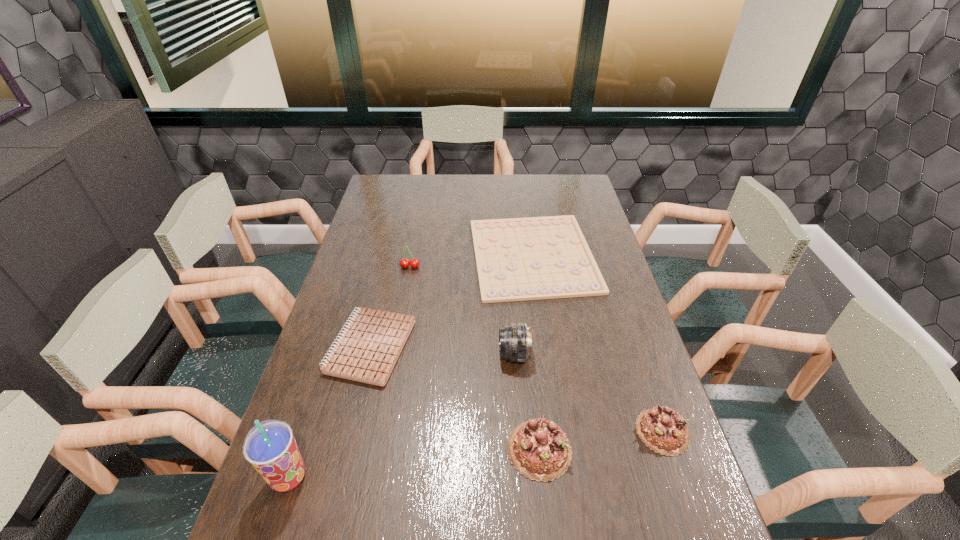
Where is `the fourth shortest object`? the fourth shortest object is located at coordinates (538, 449).

I want to click on the taller chocolate cake, so click(538, 449).

At what (x,y) coordinates should I click in order to perform the action: click on the right chocolate cake. Please return your answer as a coordinate pair (x, y). Image resolution: width=960 pixels, height=540 pixels. Looking at the image, I should click on (662, 429).

What are the coordinates of `the shorter chocolate cake` in the screenshot? It's located at (662, 429).

Where is `the third tallest object`? Image resolution: width=960 pixels, height=540 pixels. the third tallest object is located at coordinates (404, 263).

Identify the location of the shortest object. (517, 259).

Where is `notebook`? notebook is located at coordinates (369, 347).

The image size is (960, 540). What are the coordinates of `the sixth shortest object` in the screenshot? It's located at (515, 340).

Where is `smoothie`? smoothie is located at coordinates (270, 447).

Where is `free point located 0.120m on the right of the fourth shortest object`? The image size is (960, 540). free point located 0.120m on the right of the fourth shortest object is located at coordinates (623, 450).